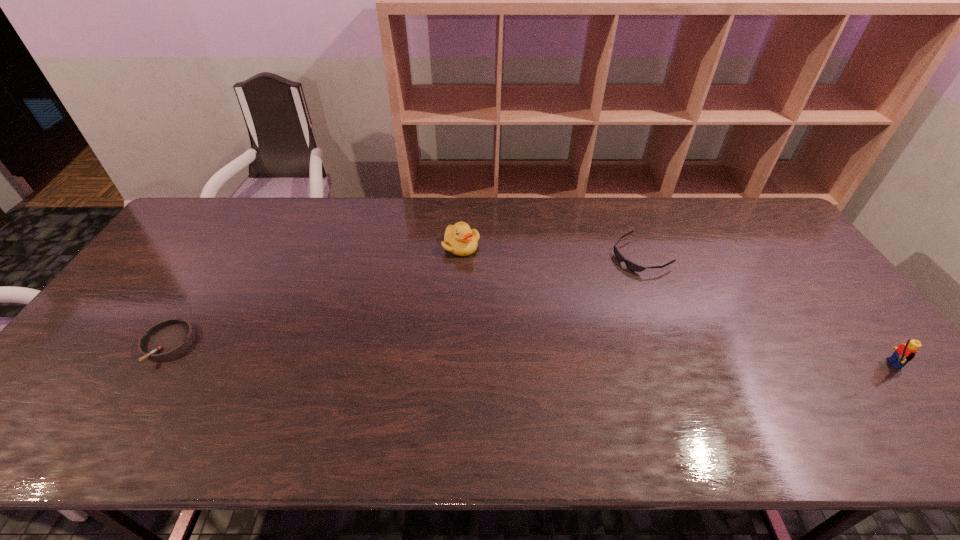
The image size is (960, 540). In order to click on the leftmost object in this screenshot , I will do `click(166, 339)`.

Find the location of a particular element. This screenshot has height=540, width=960. ashtray is located at coordinates (166, 339).

Find the location of a particular element. The width and height of the screenshot is (960, 540). the rightmost object is located at coordinates (905, 352).

You are a GUI agent. You are given a task and a screenshot of the screen. Output one action in this format:
    pyautogui.click(x=<x>, y=<y>)
    Task: Click on the tallest object
    The width and height of the screenshot is (960, 540).
    Given the screenshot: What is the action you would take?
    pyautogui.click(x=905, y=352)

The width and height of the screenshot is (960, 540). What are the coordinates of `the second object from left to right` in the screenshot? It's located at (459, 239).

Identify the location of the third shortest object. This screenshot has width=960, height=540. (459, 239).

Locate an element on the screen. sunglasses is located at coordinates (630, 265).

Identify the location of the third object from left to right. (630, 265).

I want to click on vacant region located 0.100m on the left of the leftmost object, so click(x=104, y=345).

Find the location of a particular element. vacant space located 0.270m on the front-facing side of the Lego is located at coordinates (762, 364).